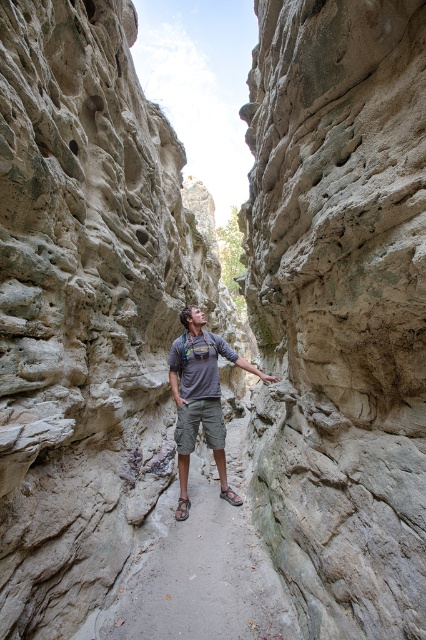
Question: Does gray rough rock at center have a greater width compared to gray fabric shirt at center?

Choices:
 (A) no
 (B) yes

Answer: (A)

Question: Which is nearer to the gray rough rock at center?

Choices:
 (A) gray fabric shirt at center
 (B) gray sand at center

Answer: (A)

Question: Is gray rough rock at center further to the viewer compared to gray sand at center?

Choices:
 (A) no
 (B) yes

Answer: (B)

Question: Is gray rough rock at center below gray sand at center?

Choices:
 (A) yes
 (B) no

Answer: (B)

Question: Which point appears closest to the camera in this image?

Choices:
 (A) (379, 141)
 (B) (213, 426)

Answer: (A)

Question: Which point is closer to the camera?

Choices:
 (A) gray sand at center
 (B) gray fabric shirt at center

Answer: (A)